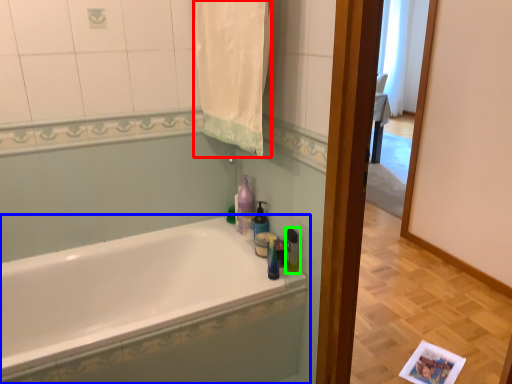
Question: Which is nearer to the bath towel (highlighted by a red box)? bathtub (highlighted by a blue box) or toiletry (highlighted by a green box).

Choices:
 (A) bathtub
 (B) toiletry

Answer: (B)